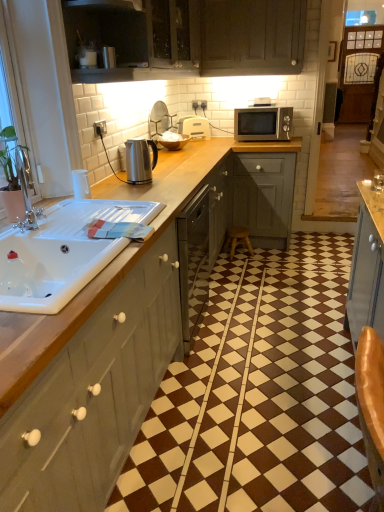
Locate an element on the screen. The width and height of the screenshot is (384, 512). free point to the left of wooden stool at center is located at coordinates (223, 257).